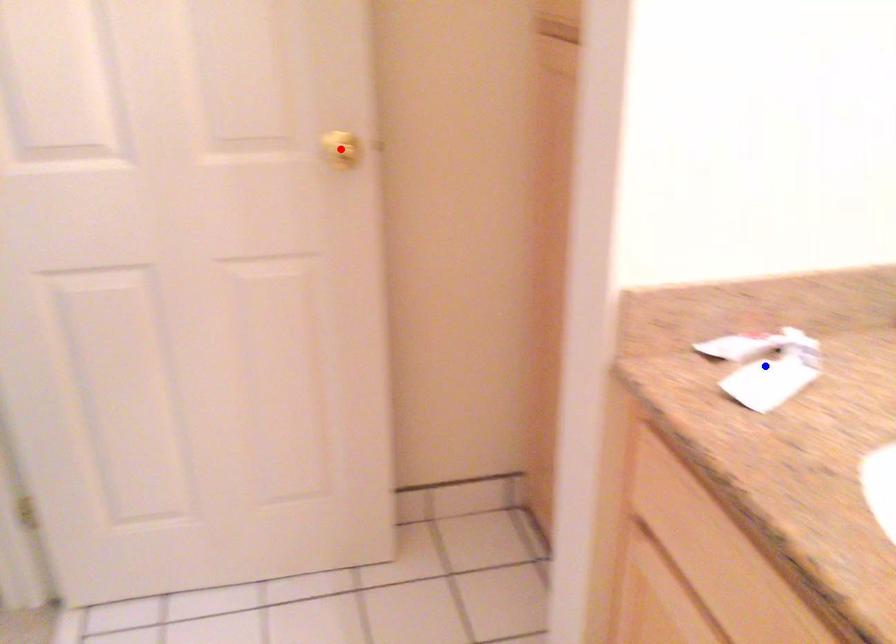
Question: In the image, two points are highlighted. Which point is nearer to the camera? Reply with the corresponding letter.

Choices:
 (A) blue point
 (B) red point

Answer: (A)